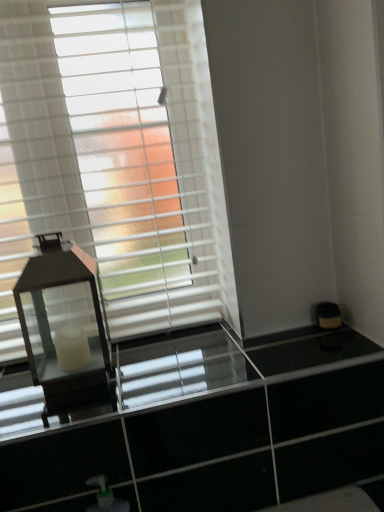
Locate an element on the screen. The height and width of the screenshot is (512, 384). vacant area that is situated to the right of matte black lantern at left is located at coordinates (158, 360).